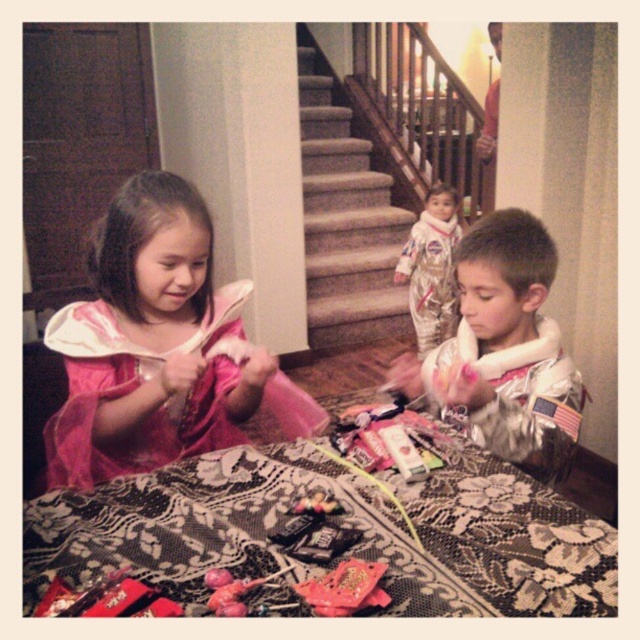
You are a parent looking for a shiny metallic toy at center in the image. According to the coordinates provided, where exactly would you find it?

The shiny metallic toy at center is located at point coordinates of (346, 588).

You are a parent organizing a Halloween party and want to place the silver metallic astronaut suit at center and the rubberized plastic toy at lower center on a shelf. The shelf has a height limit of 10 cm. Can both items fit vertically without exceeding the height limit?

The silver metallic astronaut suit at center is located above the rubberized plastic toy at lower center, but their individual heights are not specified. Therefore, it is uncertain if they can fit within the 10 cm height limit without more information about their sizes.

You are a parent organizing a Halloween party for your kids. You have two items on the table, the silver metallic astronaut suit at center and the rubberized plastic toy at lower center. Which item is taller?

The silver metallic astronaut suit at center is taller than the rubberized plastic toy at lower center.